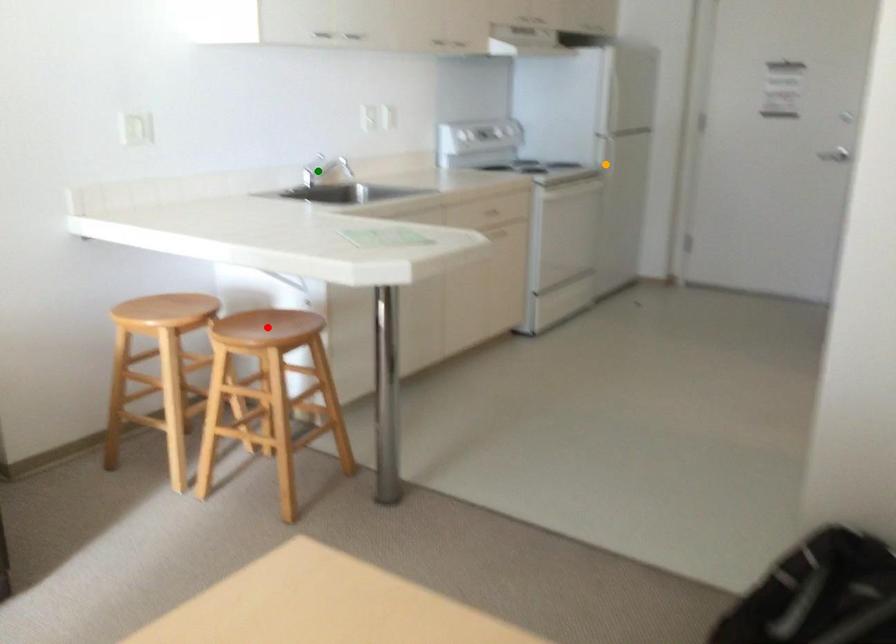
Order these from farthest to nearest:
1. orange point
2. green point
3. red point

1. orange point
2. green point
3. red point